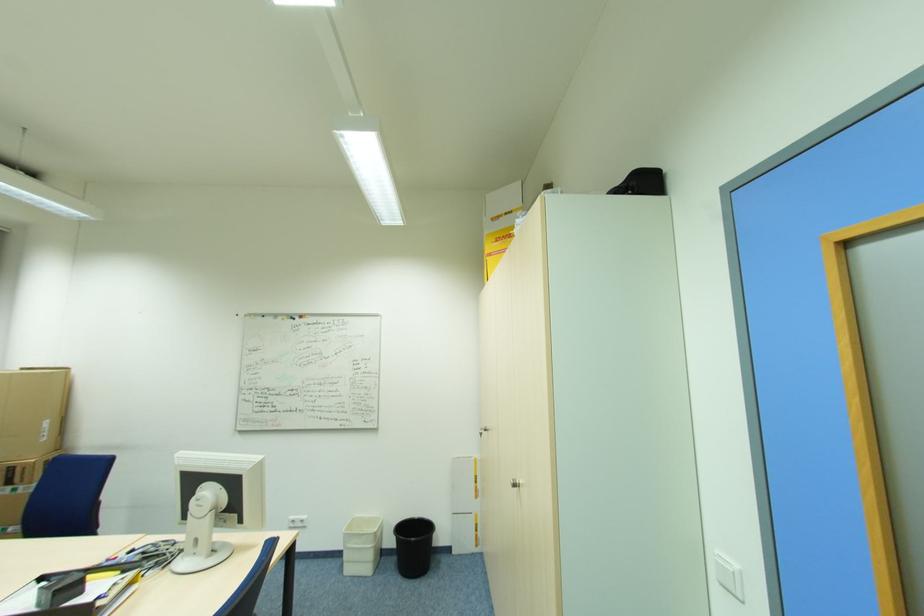
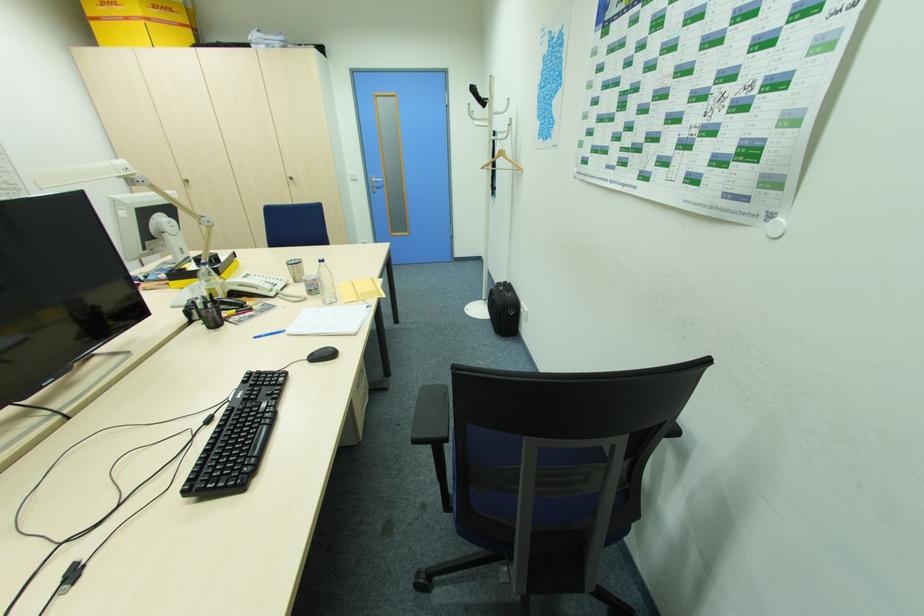
Where in the second image is the point corresponding to (x=483, y=434) from the first image?

(188, 185)